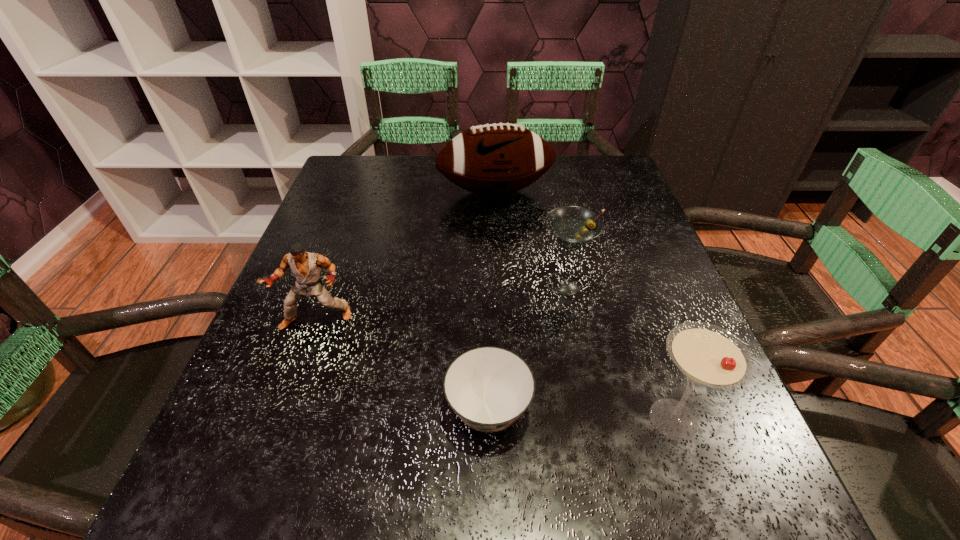
I want to click on object identified as the fourth closest to the fourth nearest object, so click(x=306, y=267).

Where is `the second closest object to the farthest object`? This screenshot has height=540, width=960. the second closest object to the farthest object is located at coordinates (306, 267).

Where is `free space that satisfies the following two spatial constraints: 1. on the back side of the soup bowl; 2. on the right side of the second farthest object`? The image size is (960, 540). free space that satisfies the following two spatial constraints: 1. on the back side of the soup bowl; 2. on the right side of the second farthest object is located at coordinates (487, 284).

The image size is (960, 540). Identify the location of blank space that satisfies the following two spatial constraints: 1. on the front-facing side of the puncher; 2. on the left side of the nearer martini. (281, 419).